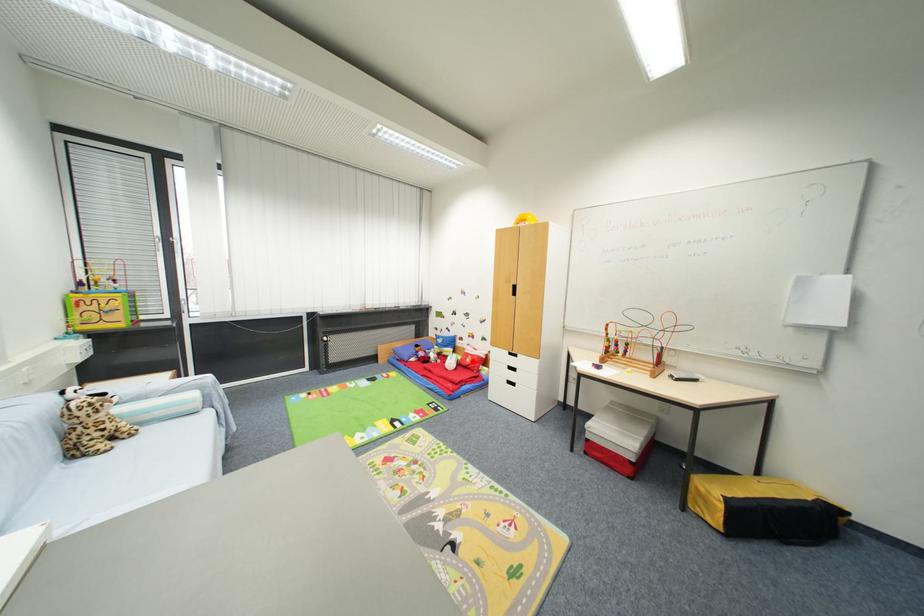
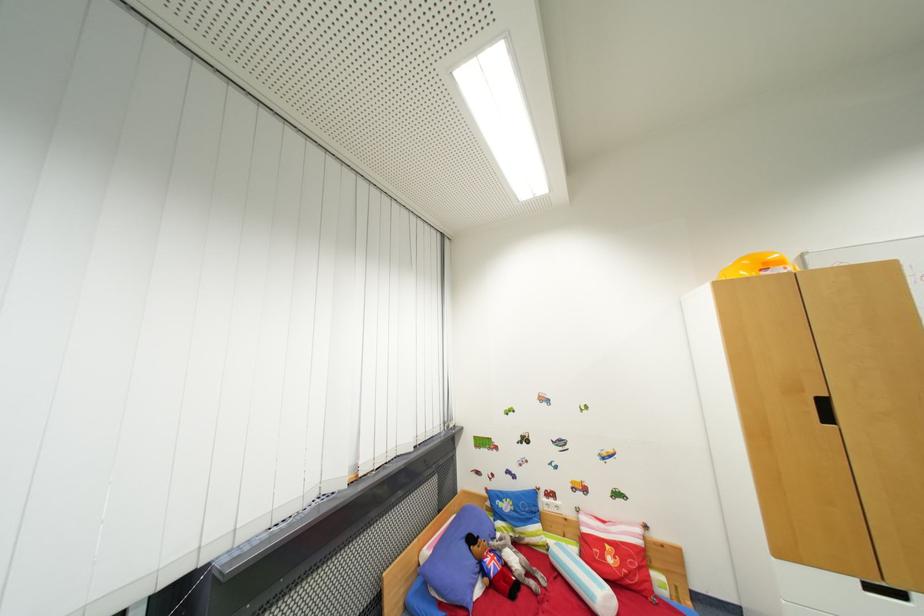
In the second image, find the point that corresponds to the highlighted location in the first image.

(614, 562)